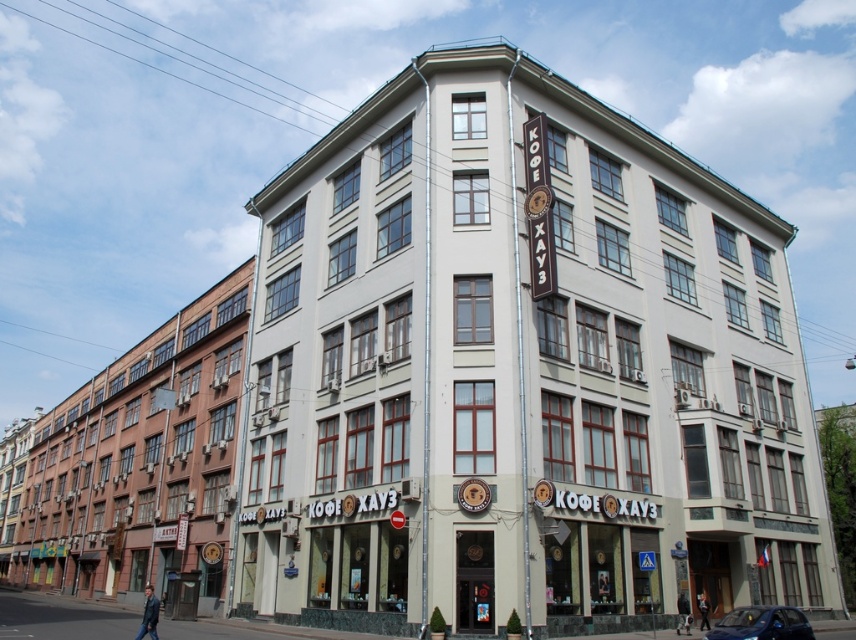
You are standing in front of the building and want to park your car behind the white smooth building at center so that it is hidden from the current viewpoint. Is the shiny blue car at lower right currently visible from your position? Explain why or why not.

The white smooth building at center is further to the viewer than the shiny blue car at lower right. Since the building is closer to you, it would block the view of the car behind it. Therefore, the shiny blue car at lower right is not visible from your current position.

From the picture: You are a photographer standing in front of the white smooth building at center and the shiny blue car at lower right. Which object would you need to look up more to capture in your photo?

The white smooth building at center has a greater height compared to the shiny blue car at lower right, so you would need to look up more to capture the white smooth building at center in your photo.

You are a photographer trying to capture the white smooth building at center and the shiny blue car at lower right in a single frame. Based on their sizes, which object would appear bigger in the photo?

The white smooth building at center would appear bigger in the photo because its width is larger than the shiny blue car at lower right.